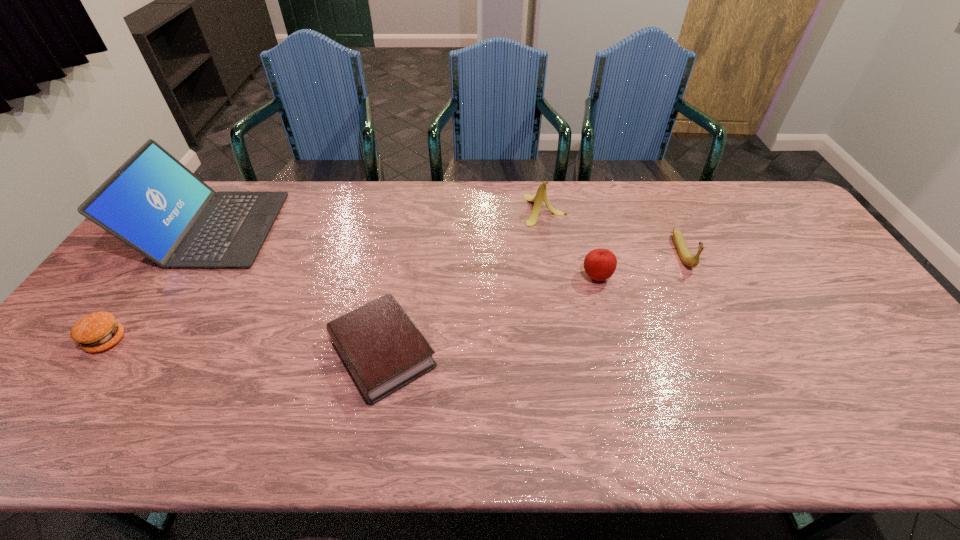
Locate an element on the screen. This screenshot has height=540, width=960. the tallest object is located at coordinates (153, 203).

In order to click on the farther banana in this screenshot , I will do `click(541, 195)`.

You are a GUI agent. You are given a task and a screenshot of the screen. Output one action in this format:
    pyautogui.click(x=<x>, y=<y>)
    Task: Click on the left banana
    Image resolution: width=960 pixels, height=540 pixels.
    Given the screenshot: What is the action you would take?
    pyautogui.click(x=541, y=195)

This screenshot has height=540, width=960. What are the coordinates of `the rightmost object` in the screenshot? It's located at (687, 258).

Locate an element on the screen. The height and width of the screenshot is (540, 960). the nearer banana is located at coordinates (687, 258).

Identify the location of the fourth tallest object. This screenshot has width=960, height=540. (599, 264).

I want to click on the fifth object from left to right, so click(599, 264).

Locate an element on the screen. patty is located at coordinates (98, 331).

Where is `the third object from left to right`? Image resolution: width=960 pixels, height=540 pixels. the third object from left to right is located at coordinates (384, 350).

Where is `free spot located 0.200m on the screen of the laptop computer`? free spot located 0.200m on the screen of the laptop computer is located at coordinates (335, 229).